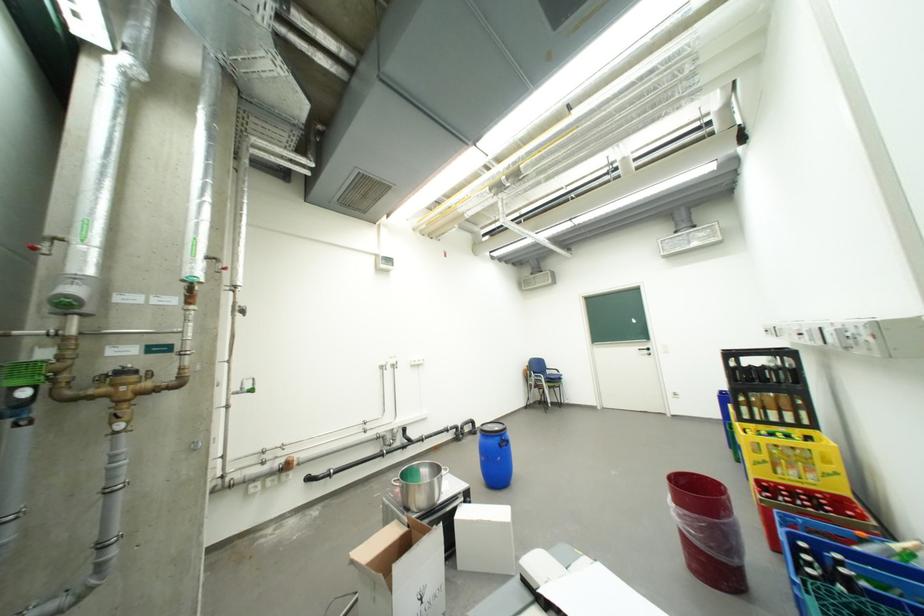
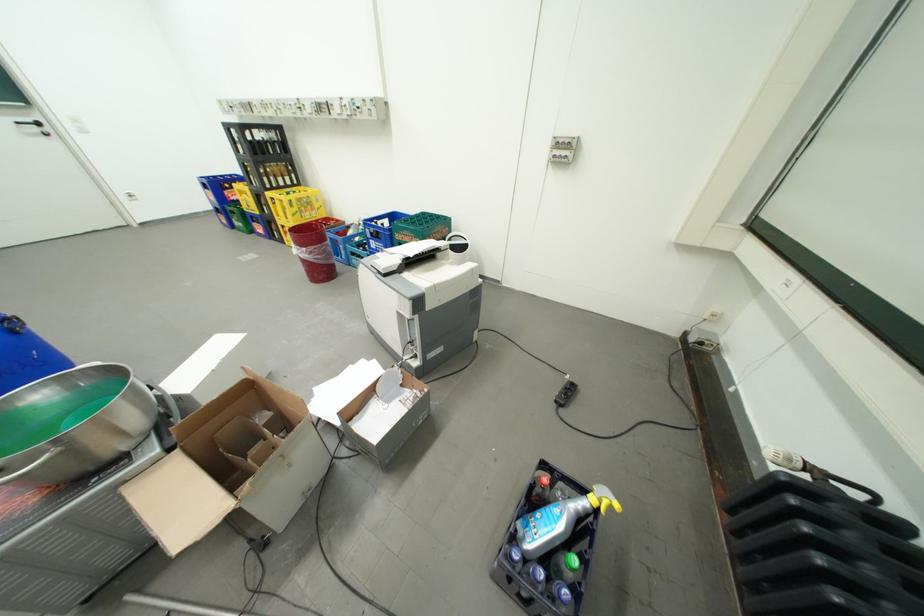
Locate, in the second image, the point that corresponds to (x=655, y=349) in the first image.

(41, 122)